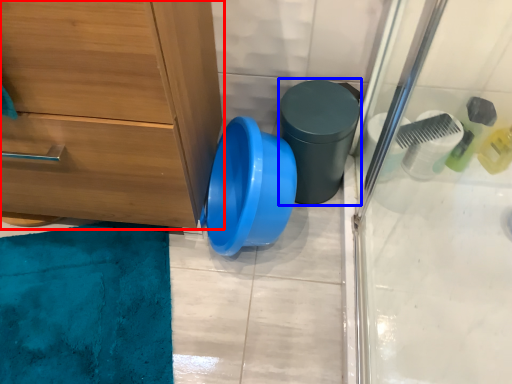
Question: Which object appears farthest to the camera in this image, chest of drawers (highlighted by a red box) or potty (highlighted by a blue box)?

Choices:
 (A) chest of drawers
 (B) potty

Answer: (B)